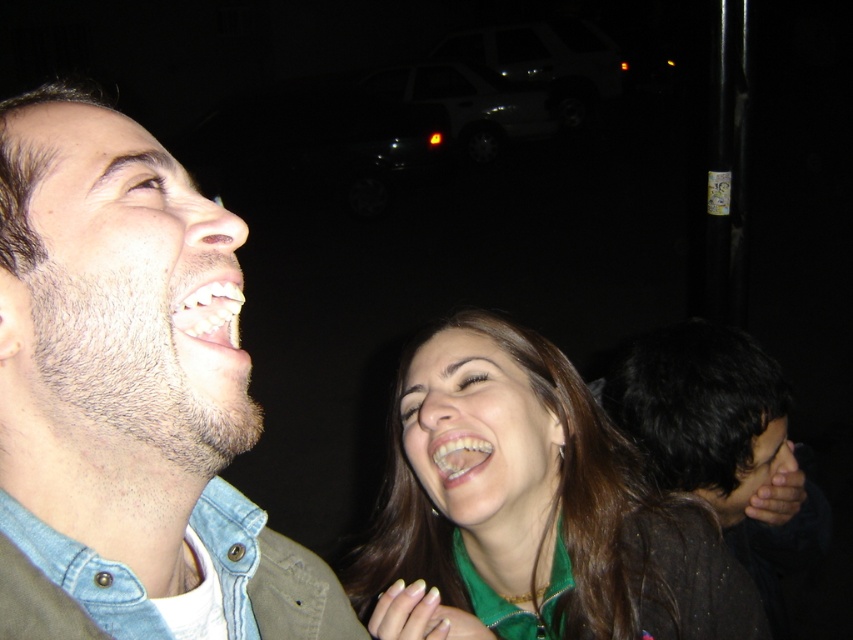
Between point (30, 132) and point (456, 483), which one is positioned behind?

The point (456, 483) is more distant.

Can you confirm if denim jacket at left is shorter than white glossy teeth at center?

No, denim jacket at left is not shorter than white glossy teeth at center.

Who is more forward, (27, 454) or (451, 444)?

Positioned in front is point (27, 454).

Where is `denim jacket at left`? denim jacket at left is located at coordinates (126, 380).

Does dark brown hair at lower right appear under white glossy teeth at lower left?

Yes.

Is dark brown hair at lower right thinner than white glossy teeth at lower left?

No.

Find the location of a particular element. Image resolution: width=853 pixels, height=640 pixels. dark brown hair at lower right is located at coordinates (723, 444).

Is denim jacket at left below shiny brown hair at lower right?

No, denim jacket at left is not below shiny brown hair at lower right.

Can you confirm if denim jacket at left is positioned to the right of shiny brown hair at lower right?

Incorrect, denim jacket at left is not on the right side of shiny brown hair at lower right.

Locate an element on the screen. denim jacket at left is located at coordinates (126, 380).

The height and width of the screenshot is (640, 853). Identify the location of denim jacket at left. (126, 380).